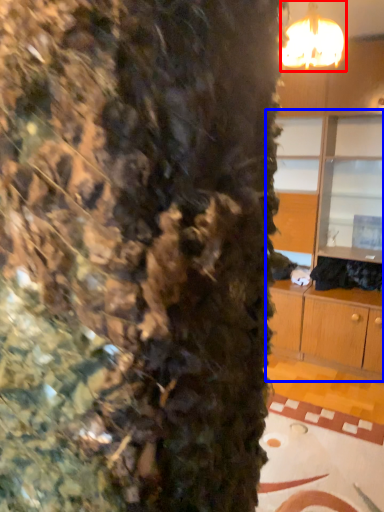
Question: Which object is closer to the camera taking this photo, lamp (highlighted by a red box) or dresser (highlighted by a blue box)?

Choices:
 (A) lamp
 (B) dresser

Answer: (A)